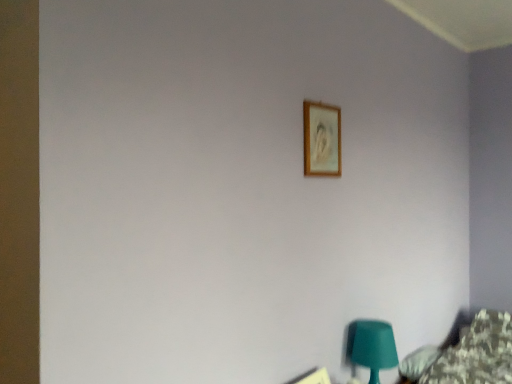
Question: Does wooden picture frame at upper center, which is the 1th picture frame in bottom-to-top order, appear on the left side of matte green plastic table lamp at lower right?

Choices:
 (A) no
 (B) yes

Answer: (B)

Question: Is matte green plastic table lamp at lower right surrounded by wooden picture frame at upper center, arranged as the 2th picture frame when viewed from the top?

Choices:
 (A) no
 (B) yes

Answer: (A)

Question: From the image's perspective, would you say wooden picture frame at upper center, which is the 1th picture frame in bottom-to-top order, is shown under matte green plastic table lamp at lower right?

Choices:
 (A) no
 (B) yes

Answer: (B)

Question: Is wooden picture frame at upper center, which is the 1th picture frame in bottom-to-top order, not within matte green plastic table lamp at lower right?

Choices:
 (A) yes
 (B) no

Answer: (A)

Question: Is wooden picture frame at upper center, which is the 1th picture frame in bottom-to-top order, taller than matte green plastic table lamp at lower right?

Choices:
 (A) no
 (B) yes

Answer: (A)

Question: Considering the relative positions of wooden picture frame at upper center, which is the 1th picture frame in bottom-to-top order, and wooden frame at upper center, the 1th picture frame positioned from the top, in the image provided, is wooden picture frame at upper center, which is the 1th picture frame in bottom-to-top order, to the left or to the right of wooden frame at upper center, the 1th picture frame positioned from the top,?

Choices:
 (A) left
 (B) right

Answer: (A)

Question: From their relative heights in the image, would you say wooden picture frame at upper center, arranged as the 2th picture frame when viewed from the top, is taller or shorter than wooden frame at upper center, the second picture frame in the bottom-to-top sequence?

Choices:
 (A) tall
 (B) short

Answer: (B)

Question: Looking at their shapes, would you say wooden picture frame at upper center, arranged as the 2th picture frame when viewed from the top, is wider or thinner than wooden frame at upper center, the 1th picture frame positioned from the top?

Choices:
 (A) wide
 (B) thin

Answer: (A)

Question: Considering their positions, is wooden picture frame at upper center, arranged as the 2th picture frame when viewed from the top, located in front of or behind wooden frame at upper center, the 1th picture frame positioned from the top?

Choices:
 (A) front
 (B) behind

Answer: (A)

Question: From the image's perspective, relative to wooden picture frame at upper center, arranged as the 2th picture frame when viewed from the top, is matte green plastic table lamp at lower right above or below?

Choices:
 (A) below
 (B) above

Answer: (B)

Question: Is matte green plastic table lamp at lower right in front of or behind wooden picture frame at upper center, which is the 1th picture frame in bottom-to-top order, in the image?

Choices:
 (A) behind
 (B) front

Answer: (A)

Question: Would you say matte green plastic table lamp at lower right is to the left or to the right of wooden picture frame at upper center, arranged as the 2th picture frame when viewed from the top, in the picture?

Choices:
 (A) left
 (B) right

Answer: (B)

Question: Choose the correct answer: Is matte green plastic table lamp at lower right inside wooden picture frame at upper center, which is the 1th picture frame in bottom-to-top order, or outside it?

Choices:
 (A) outside
 (B) inside

Answer: (A)

Question: Is matte green plastic table lamp at lower right taller or shorter than wooden frame at upper center, the second picture frame in the bottom-to-top sequence?

Choices:
 (A) short
 (B) tall

Answer: (B)

Question: From the image's perspective, is matte green plastic table lamp at lower right positioned above or below wooden frame at upper center, the second picture frame in the bottom-to-top sequence?

Choices:
 (A) below
 (B) above

Answer: (A)